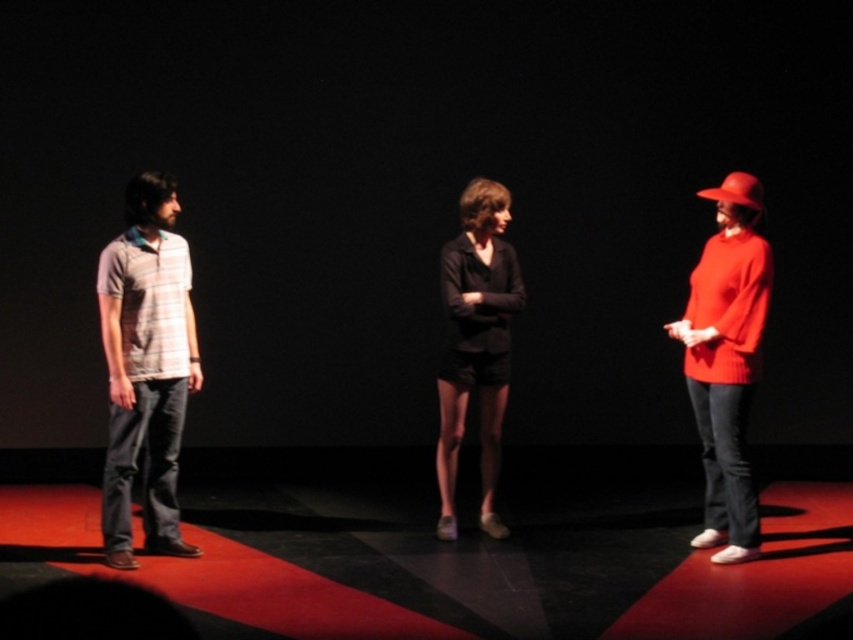
Does striped cotton polo shirt at left lie behind black matte shorts at center?

No, it is not.

You are a GUI agent. You are given a task and a screenshot of the screen. Output one action in this format:
    pyautogui.click(x=<x>, y=<y>)
    Task: Click on the striped cotton polo shirt at left
    The width and height of the screenshot is (853, 640).
    Given the screenshot: What is the action you would take?
    pyautogui.click(x=146, y=365)

This screenshot has width=853, height=640. Find the location of `striped cotton polo shirt at left`. striped cotton polo shirt at left is located at coordinates click(x=146, y=365).

Where is `striped cotton polo shirt at left`? The height and width of the screenshot is (640, 853). striped cotton polo shirt at left is located at coordinates (146, 365).

Can you confirm if matte red sweater at right is positioned below black matte shorts at center?

Correct, matte red sweater at right is located below black matte shorts at center.

Is point (730, 218) closer to camera compared to point (497, 396)?

Yes.

Where is `matte red sweater at right`? This screenshot has height=640, width=853. matte red sweater at right is located at coordinates (726, 360).

Does striped cotton polo shirt at left appear over matte red sweater at right?

Indeed, striped cotton polo shirt at left is positioned over matte red sweater at right.

Which is more to the right, striped cotton polo shirt at left or matte red sweater at right?

matte red sweater at right

Which is behind, point (148, 205) or point (743, 256)?

Positioned behind is point (743, 256).

Identify the location of striped cotton polo shirt at left. (146, 365).